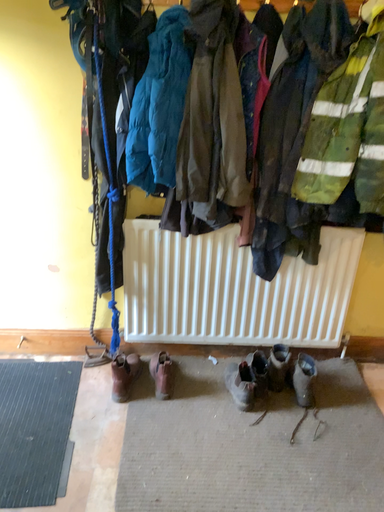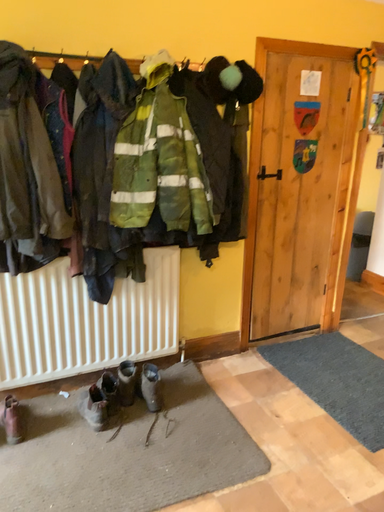
Question: Which way did the camera rotate in the video?

Choices:
 (A) rotated right
 (B) rotated left

Answer: (A)